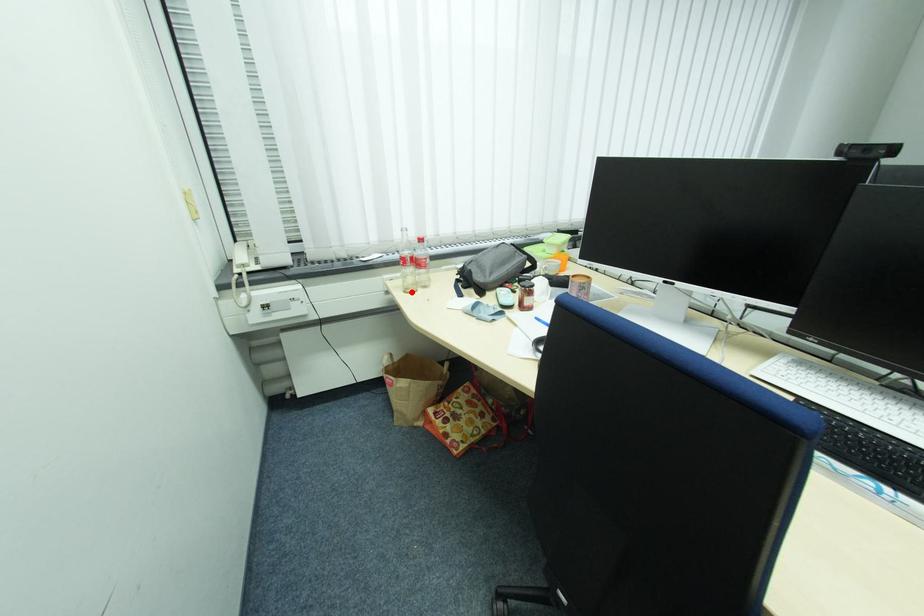
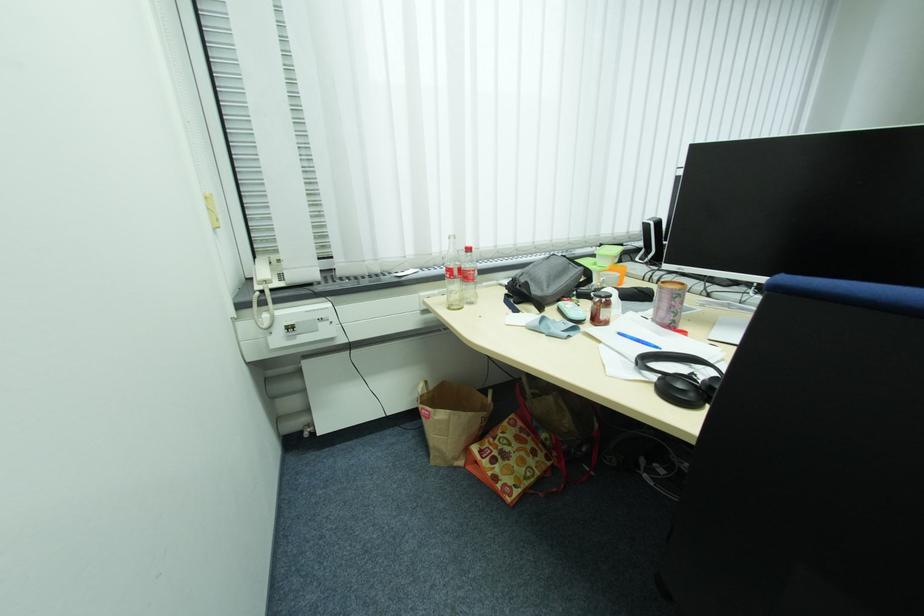
Find the pixel in the second image that matches the highlighted location in the first image.

(456, 309)